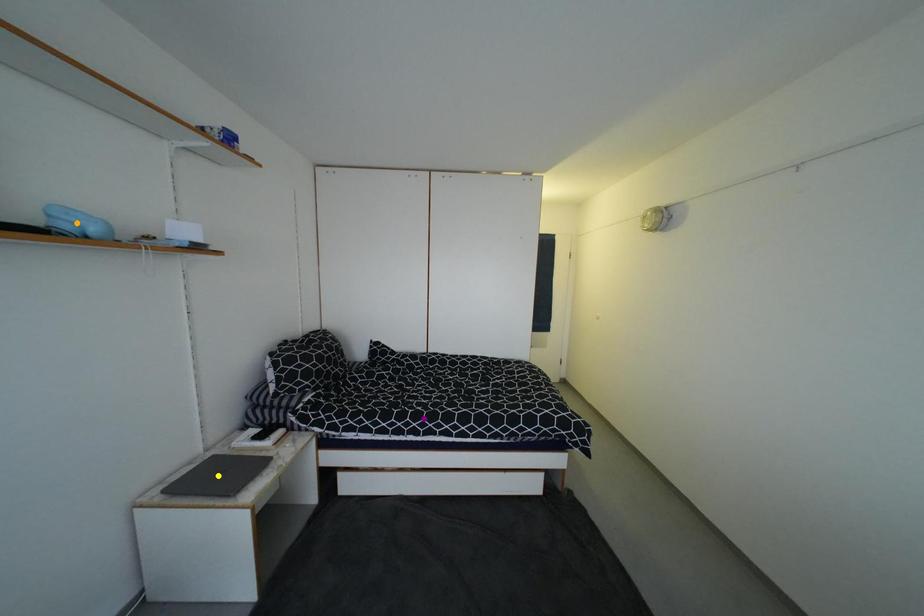
Order these from nearest to farthest:
1. orange point
2. purple point
3. yellow point

1. purple point
2. yellow point
3. orange point